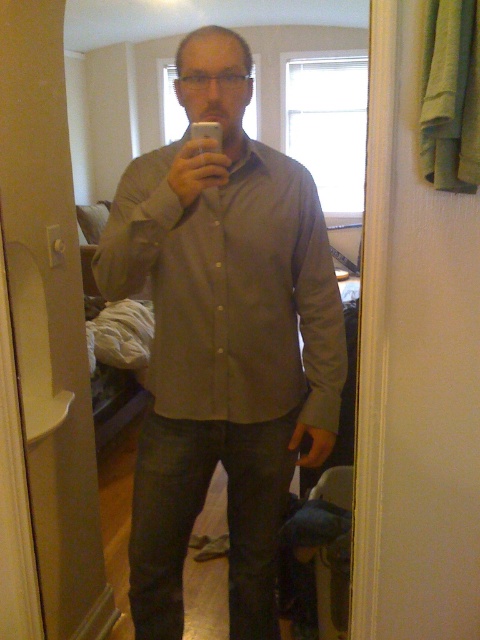
You are a fashion designer trying to create a virtual fitting room. You have two shirts displayed side by side in the mirror image. The shirts are the matte brown shirt at center and the matte gray shirt at center. How far apart are these two shirts in the mirror?

The matte brown shirt at center is 5.16 meters from the matte gray shirt at center in the mirror.

You are a fashion stylist assisting a client who wants to choose between the matte brown shirt at center and the matte gray shirt at center for an interview. Based on the image, which shirt is more prominent and thus might be a better choice for visibility?

The matte brown shirt at center is closer to the viewer than the matte gray shirt at center, making it more prominent in the image. This could be a better choice for visibility in an interview setting.